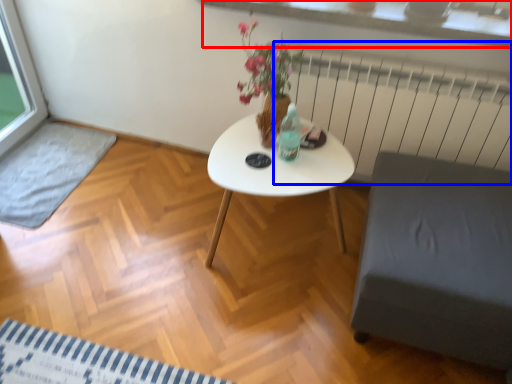
Question: Which point is further to the camera, window sill (highlighted by a red box) or radiator (highlighted by a blue box)?

Choices:
 (A) window sill
 (B) radiator

Answer: (B)